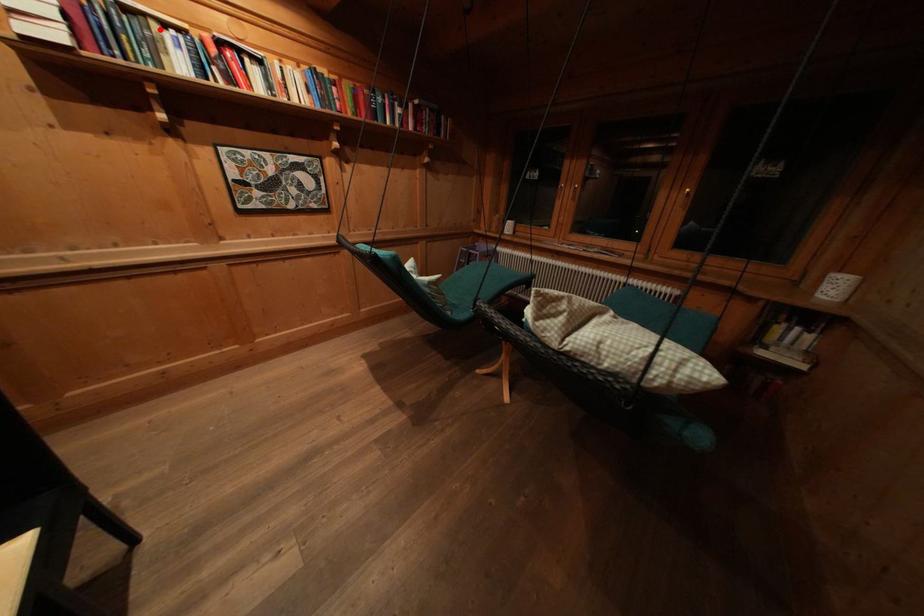
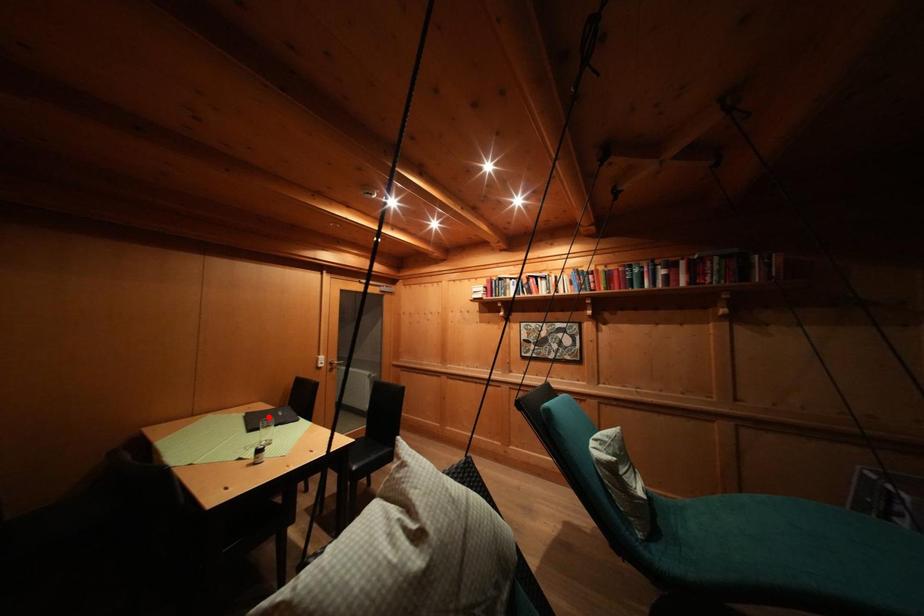
I am providing you with two images of the same scene from different viewpoints. A red point is marked on the first image and another point is marked on the second image. Do the highlighted points in image1 and image2 indicate the same real-world spot?

No